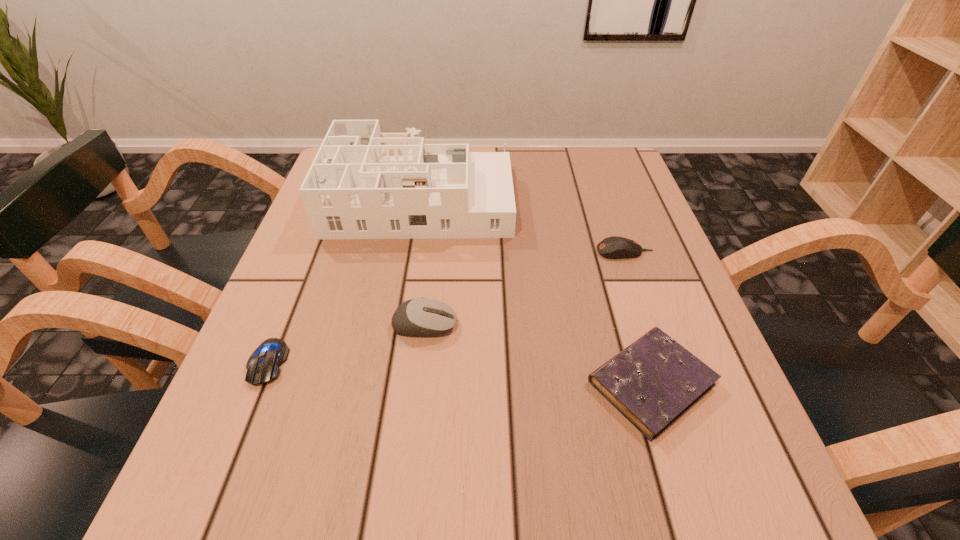
Find the location of `free location located on the back of the farthest computer mouse`. free location located on the back of the farthest computer mouse is located at coordinates (610, 208).

You are a GUI agent. You are given a task and a screenshot of the screen. Output one action in this format:
    pyautogui.click(x=<x>, y=<y>)
    Task: Click on the vacant space located 0.070m on the button side of the leftmost computer mouse
    
    Given the screenshot: What is the action you would take?
    point(240,430)

At what (x,y) coordinates should I click in order to perform the action: click on vacant space located 0.400m on the back of the diary. Please return your answer as a coordinate pair (x, y). This screenshot has width=960, height=540. Looking at the image, I should click on (594, 201).

Locate an element on the screen. The height and width of the screenshot is (540, 960). object located in the far edge section of the desktop is located at coordinates (363, 184).

Identify the location of dollhouse that is at the left edge. (363, 184).

The width and height of the screenshot is (960, 540). Identify the location of computer mouse positioned at the left edge. (263, 365).

Image resolution: width=960 pixels, height=540 pixels. In order to click on computer mouse at the right edge in this screenshot , I will do tap(614, 247).

At what (x,y) coordinates should I click in order to perform the action: click on diary that is at the right edge. Please return your answer as a coordinate pair (x, y). The height and width of the screenshot is (540, 960). Looking at the image, I should click on (652, 382).

Image resolution: width=960 pixels, height=540 pixels. Find the location of `object positioned at the far left corner`. object positioned at the far left corner is located at coordinates (363, 184).

Identify the location of blank space at the far edge of the desktop. (548, 188).